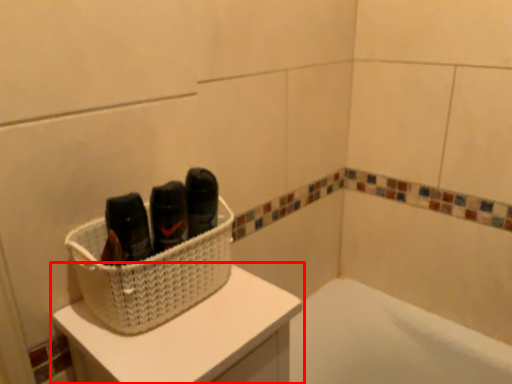
Question: Observing the image, what is the correct spatial positioning of furniture (annotated by the red box) in reference to basket?

Choices:
 (A) left
 (B) right

Answer: (B)